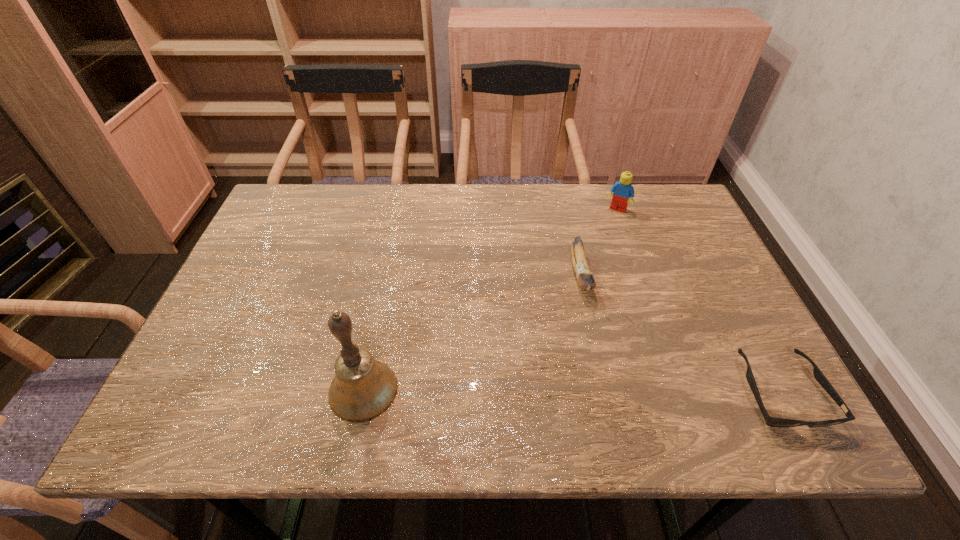
You are a GUI agent. You are given a task and a screenshot of the screen. Output one action in this format:
    pyautogui.click(x=<x>, y=<y>)
    Task: Click on the vacant space located 0.220m on the peel of the third tallest object
    
    Given the screenshot: What is the action you would take?
    tap(608, 383)

Where is `vacant region located 0.220m on the peel of the third tallest object`? The width and height of the screenshot is (960, 540). vacant region located 0.220m on the peel of the third tallest object is located at coordinates (608, 383).

Identify the location of vacant area situated 0.260m on the face of the third shortest object. (582, 269).

Locate an element on the screen. blank space located on the face of the third shortest object is located at coordinates (601, 234).

The image size is (960, 540). What are the coordinates of `vacant area situated 0.100m on the face of the third shortest object` in the screenshot? It's located at (601, 234).

This screenshot has width=960, height=540. I want to click on object positioned at the far edge, so click(x=623, y=190).

Find the location of a particular element. The height and width of the screenshot is (540, 960). bell located at the near edge is located at coordinates (363, 388).

This screenshot has width=960, height=540. Identify the location of sunglasses present at the near edge. (819, 376).

Where is `object at the right edge`? object at the right edge is located at coordinates (819, 376).

This screenshot has width=960, height=540. Find the location of `object situated at the near right corner`. object situated at the near right corner is located at coordinates (819, 376).